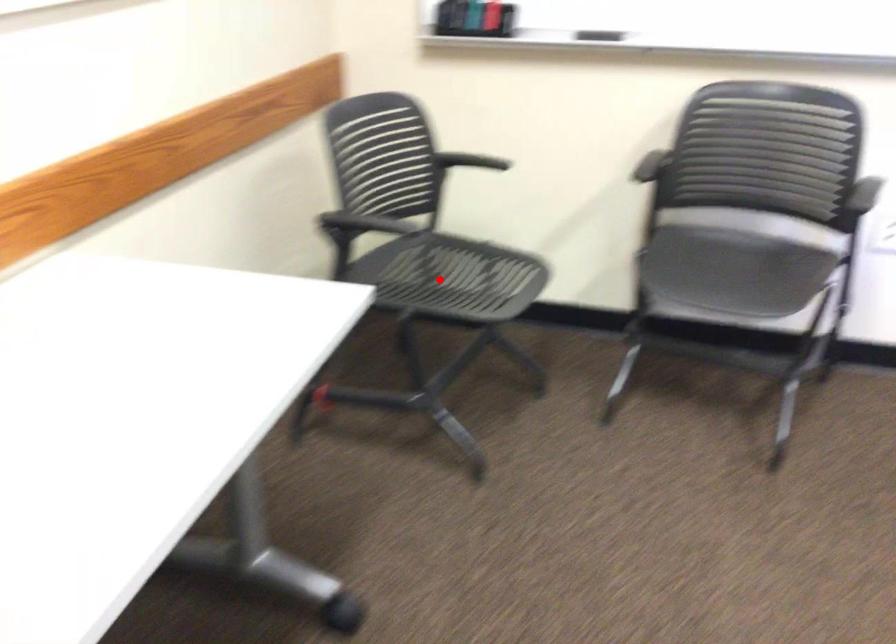
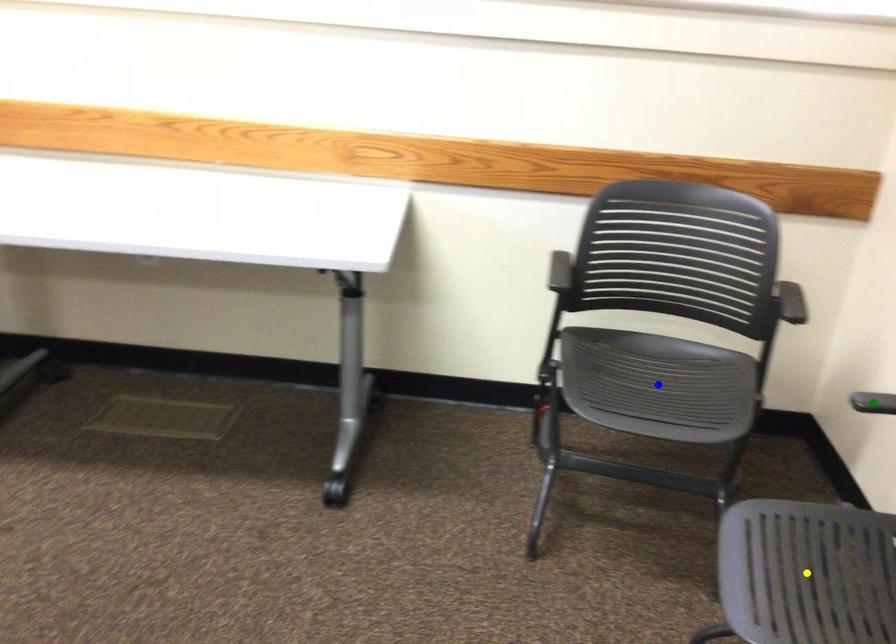
Question: I am providing you with two images of the same scene from different viewpoints. A red point is marked on the first image. You are given multiple points on the second image. Which point in image 2 is actually the same real-world point as the red point in image 1?

Choices:
 (A) green point
 (B) blue point
 (C) yellow point

Answer: (B)